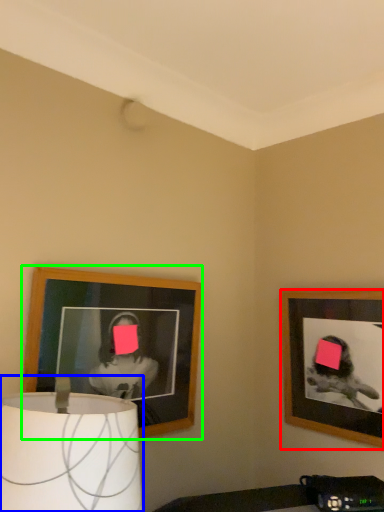
Question: Estimate the real-world distances between objects in this image. Which object is closer to picture frame (highlighted by a red box), lamp (highlighted by a blue box) or picture frame (highlighted by a green box)?

Choices:
 (A) lamp
 (B) picture frame

Answer: (B)